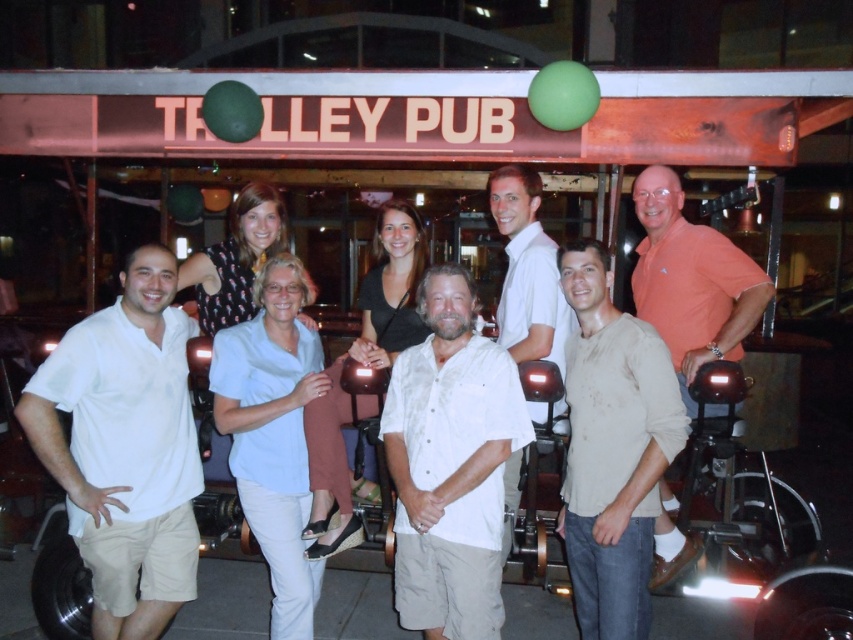
From the picture: You are trying to identify two people in the group based on their clothing. There is a person wearing a white textured shirt at center and another wearing a white cotton shirt at center. Which one is positioned to the left?

The white textured shirt at center is to the left of the white cotton shirt at center.

Based on the photo, you are a photographer trying to capture a group photo of the light beige cotton shirt at center and the white cotton shirt at center. If you want to ensure both shirts are fully visible in the frame, which shirt should you position closer to the camera to avoid overlapping?

The light beige cotton shirt at center might be wider than the white cotton shirt at center, so positioning the light beige cotton shirt at center closer to the camera would help ensure both shirts are fully visible without overlapping.